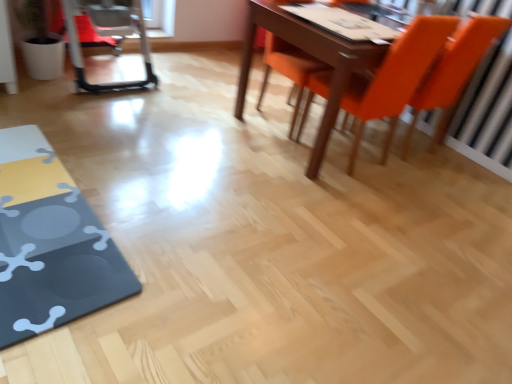
The height and width of the screenshot is (384, 512). Identify the location of free location in front of metallic silver swivel chair at left. (98, 117).